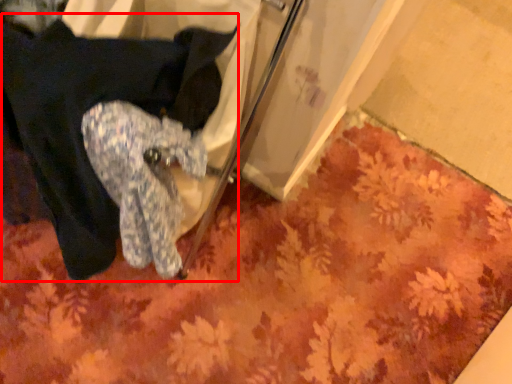
Question: From the image's perspective, what is the correct spatial relationship of clothing (annotated by the red box) in relation to mat?

Choices:
 (A) below
 (B) above

Answer: (B)